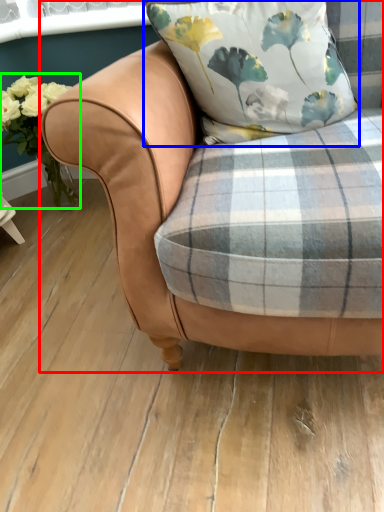
Question: Based on their relative distances, which object is nearer to chair (highlighted by a red box)? Choose from pillow (highlighted by a blue box) and floral arrangement (highlighted by a green box).

Choices:
 (A) pillow
 (B) floral arrangement

Answer: (A)